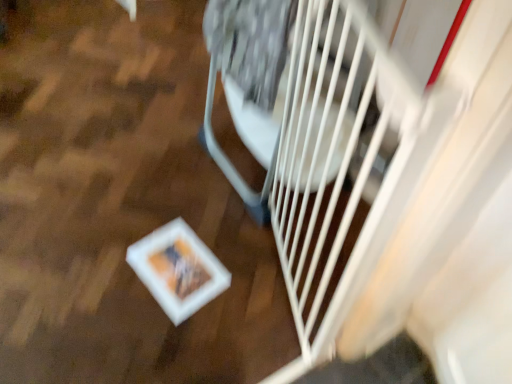
Question: Can you confirm if white matte gate at center is thinner than white plastic gate at right?

Choices:
 (A) no
 (B) yes

Answer: (A)

Question: Is white matte gate at center positioned in front of white plastic gate at right?

Choices:
 (A) yes
 (B) no

Answer: (B)

Question: Does white matte gate at center have a lesser height compared to white plastic gate at right?

Choices:
 (A) yes
 (B) no

Answer: (A)

Question: From a real-world perspective, is white matte gate at center located beneath white plastic gate at right?

Choices:
 (A) yes
 (B) no

Answer: (A)

Question: From the image's perspective, does white matte gate at center appear higher than white plastic gate at right?

Choices:
 (A) no
 (B) yes

Answer: (B)

Question: Does white matte gate at center contain white plastic gate at right?

Choices:
 (A) yes
 (B) no

Answer: (B)

Question: Can you confirm if white plastic gate at right is smaller than white matte gate at center?

Choices:
 (A) yes
 (B) no

Answer: (B)

Question: Is white plastic gate at right far from white matte gate at center?

Choices:
 (A) yes
 (B) no

Answer: (B)

Question: From a real-world perspective, is white plastic gate at right below white matte gate at center?

Choices:
 (A) no
 (B) yes

Answer: (A)

Question: Is white plastic gate at right next to white matte gate at center and touching it?

Choices:
 (A) yes
 (B) no

Answer: (B)

Question: Could you tell me if white plastic gate at right is facing white matte gate at center?

Choices:
 (A) no
 (B) yes

Answer: (A)

Question: Is white plastic gate at right outside white matte gate at center?

Choices:
 (A) no
 (B) yes

Answer: (B)

Question: In the image, is white matte gate at center on the left side or the right side of white plastic gate at right?

Choices:
 (A) left
 (B) right

Answer: (A)